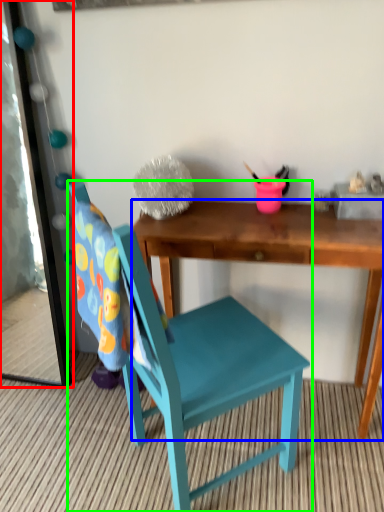
Question: Based on their relative distances, which object is farther from mirror (highlighted by a red box)? Choose from desk (highlighted by a blue box) and chair (highlighted by a green box).

Choices:
 (A) desk
 (B) chair

Answer: (A)